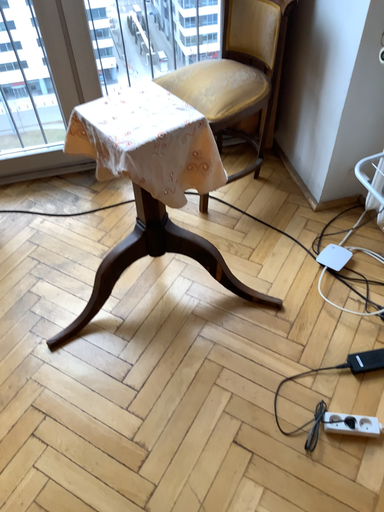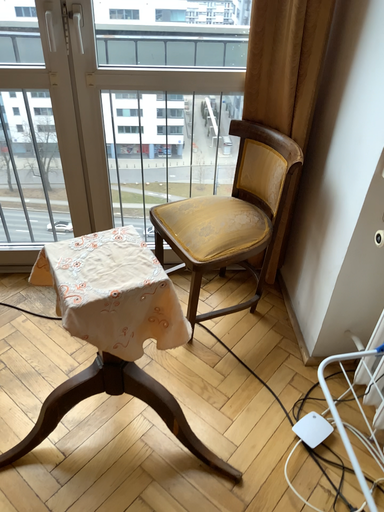
Question: How did the camera likely rotate when shooting the video?

Choices:
 (A) rotated downward
 (B) rotated upward

Answer: (B)